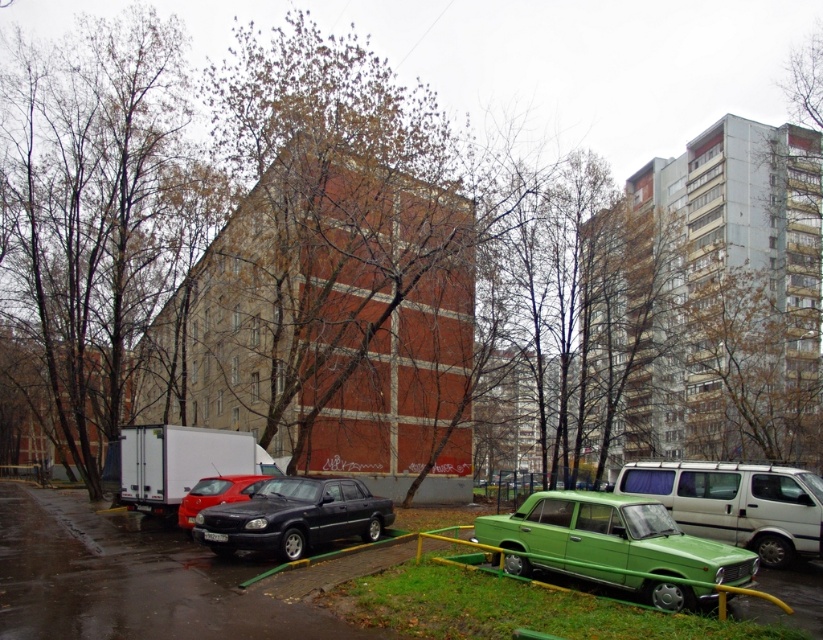
You are standing in the urban scene described. There is a point at coordinates point (515, 531). If you want to place a 1.2 meter wide box at this point, will it fit without overlapping any nearby objects?

The point at (515, 531) is 11.85 meters from the viewer. Since the box is only 1.2 meters wide, there should be enough space to place it at that point without overlapping nearby objects, as the distance provides sufficient room.

Consider the image. You are a delivery driver who needs to park your vehicle between the green matte car at center and the shiny red sedan at center. Given that your vehicle is 1.8 meters wide, can you fit your car in the space between them?

The green matte car at center is wider than the shiny red sedan at center. However, the exact width of the space between them isn not provided. Without knowing the distance between the two cars, it is impossible to determine if your 1.8 meter wide vehicle can fit.

You are a delivery driver who needs to park your truck, which is 6 meters long, in this area. Looking at the space between the metallic silver minivan at center and the shiny red sedan at center, can your truck fit there?

The metallic silver minivan at center is smaller than the shiny red sedan at center, but the description does not provide exact dimensions of the space between them. Without knowing the exact length of the available space, it is uncertain if the 6 meter truck can fit there.